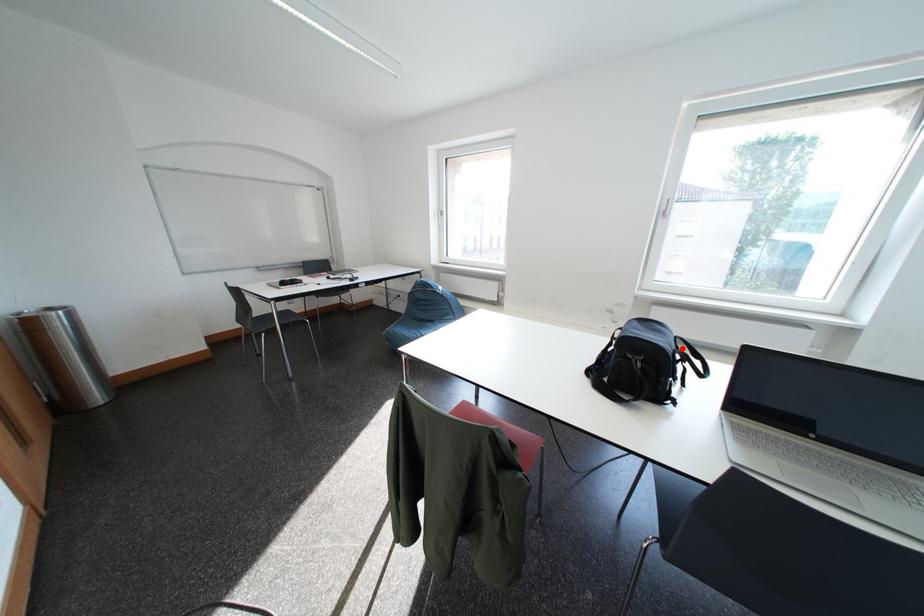
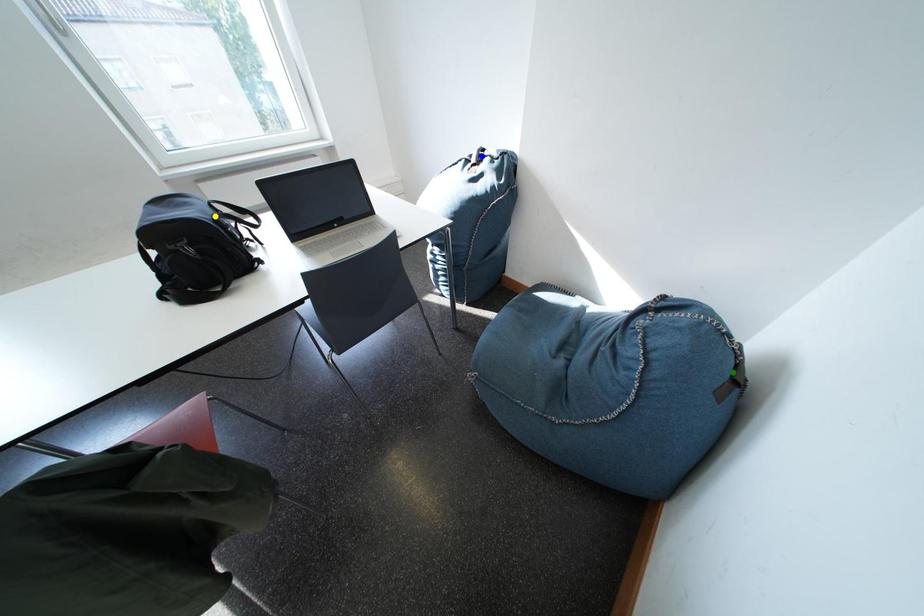
Question: I am providing you with two images of the same scene from different viewpoints. A red point is marked on the first image. You are given multiple points on the second image. Which point in image 2 is actually the same real-world point as the red point in image 1?

Choices:
 (A) yellow point
 (B) green point
 (C) blue point

Answer: (A)